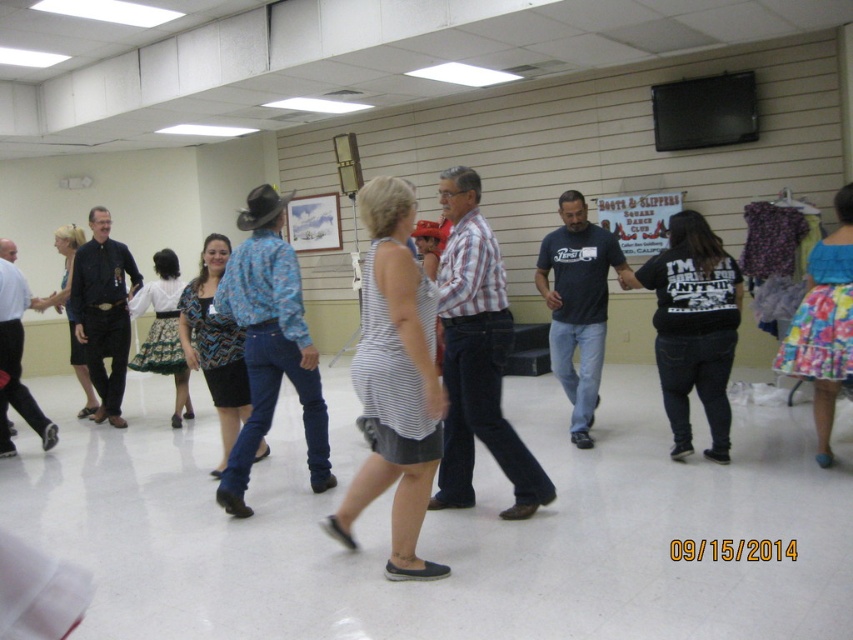
Question: Which object is closer to the camera taking this photo?

Choices:
 (A) black leather shirt at left
 (B) floral fabric skirt at lower right
 (C) dark blue t-shirt at center

Answer: (B)

Question: Which of the following is the closest to the observer?

Choices:
 (A) striped fabric dress at center
 (B) blue patterned shirt at center
 (C) black leather shirt at left

Answer: (A)

Question: In this image, where is striped fabric dress at center located relative to black leather shirt at left?

Choices:
 (A) below
 (B) above

Answer: (A)

Question: Does black matte shirt at left have a smaller size compared to black leather shirt at left?

Choices:
 (A) no
 (B) yes

Answer: (B)

Question: Is striped fabric dress at center smaller than black satin dress at center?

Choices:
 (A) no
 (B) yes

Answer: (B)

Question: Estimate the real-world distances between objects in this image. Which object is closer to the striped fabric dress at center?

Choices:
 (A) striped cotton shirt at center
 (B) black satin dress at center

Answer: (A)